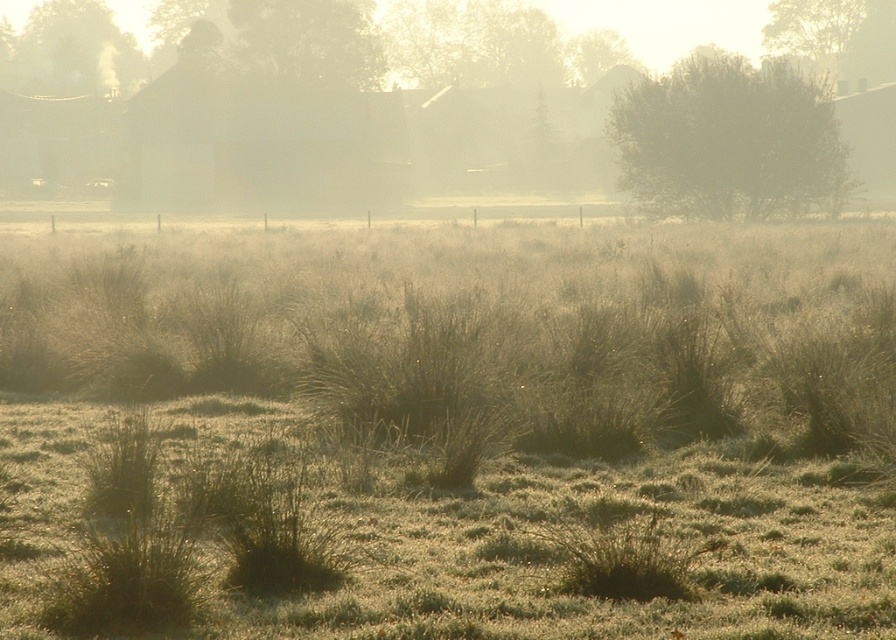
Question: Does green leafy bush at upper right lie behind green grass at upper left?

Choices:
 (A) yes
 (B) no

Answer: (B)

Question: Estimate the real-world distances between objects in this image. Which object is farther from the green leafy tree at upper center?

Choices:
 (A) green leafy bush at upper right
 (B) green grass at upper left

Answer: (B)

Question: Which point is farther to the camera?

Choices:
 (A) green grass at upper left
 (B) green leafy bush at upper right
 (C) green leafy tree at upper center

Answer: (A)

Question: Can you confirm if green leafy bush at upper right is positioned to the left of green grass at upper left?

Choices:
 (A) yes
 (B) no

Answer: (B)

Question: Is green leafy tree at upper center closer to camera compared to green grass at upper left?

Choices:
 (A) yes
 (B) no

Answer: (A)

Question: Which object is closer to the camera taking this photo?

Choices:
 (A) green leafy bush at upper right
 (B) green leafy tree at upper center

Answer: (A)